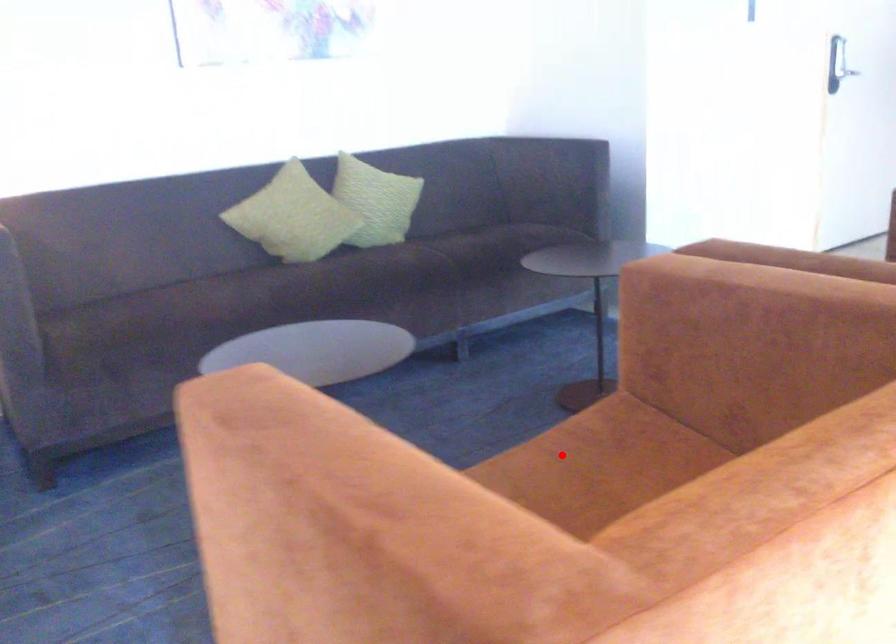
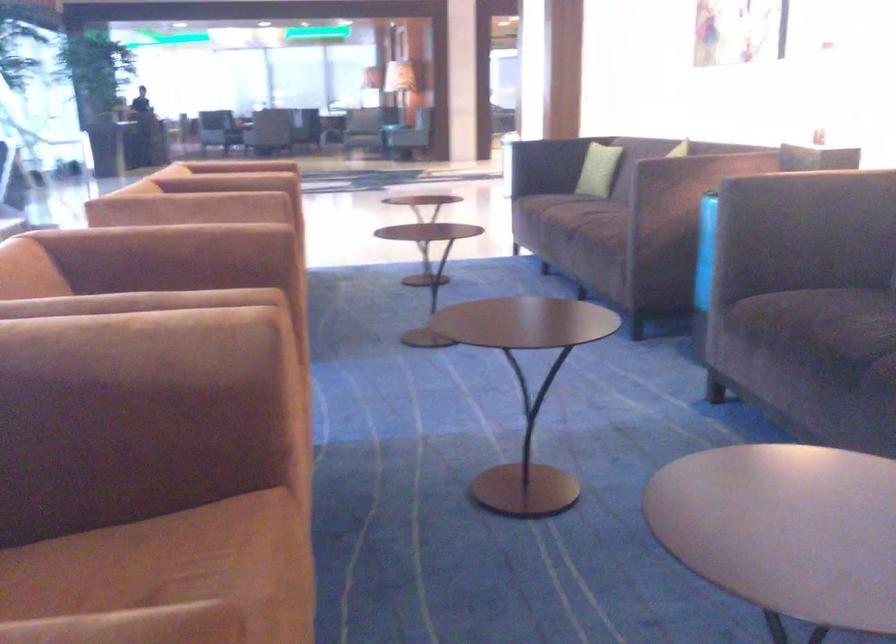
Question: I am providing you with two images of the same scene from different viewpoints. A red point is marked on the first image. Is the red point's position out of view in image 2?

Choices:
 (A) Yes
 (B) No

Answer: (A)